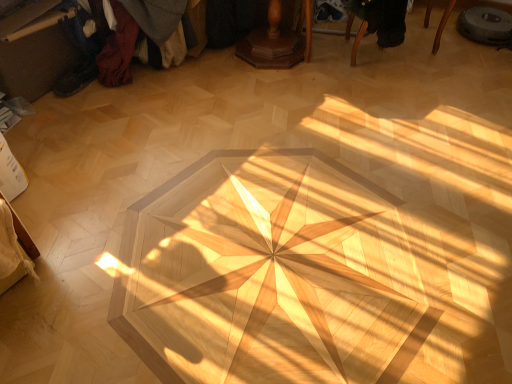
Image resolution: width=512 pixels, height=384 pixels. Describe the element at coordinates (442, 25) in the screenshot. I see `black fabric chair at upper right` at that location.

Where is `black fabric chair at upper right`? black fabric chair at upper right is located at coordinates (442, 25).

What are the coordinates of `black fabric chair at upper right` in the screenshot? It's located at (442, 25).